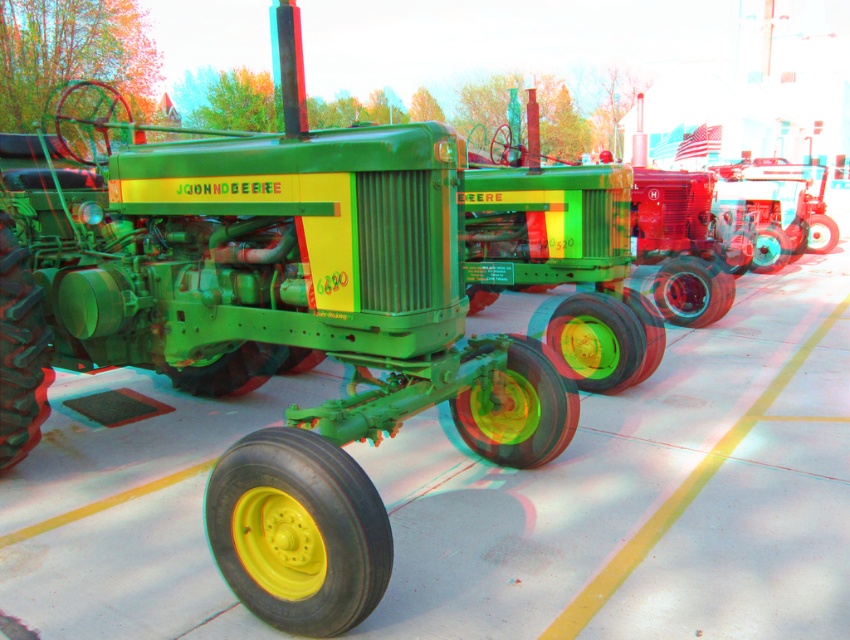
Question: Where is green matte tractor at center located in relation to yellow rubber tire at center in the image?

Choices:
 (A) right
 (B) left

Answer: (B)

Question: Can you confirm if green matte tractor at center is bigger than yellow rubber tire at center?

Choices:
 (A) yes
 (B) no

Answer: (B)

Question: Among these objects, which one is nearest to the camera?

Choices:
 (A) green matte tractor at center
 (B) yellow rubber tire at center

Answer: (B)

Question: Is green matte tractor at center wider than yellow rubber tire at center?

Choices:
 (A) yes
 (B) no

Answer: (B)